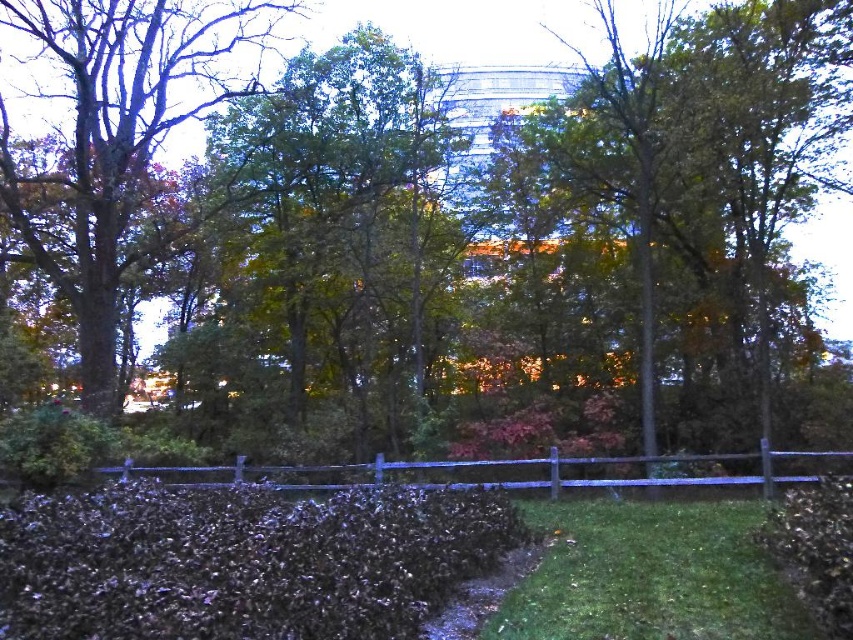
Consider the image. Is dark green leafy hedge at lower left smaller than green grass at center?

Incorrect, dark green leafy hedge at lower left is not smaller in size than green grass at center.

Who is higher up, dark green leafy hedge at lower left or green grass at center?

Positioned higher is dark green leafy hedge at lower left.

The width and height of the screenshot is (853, 640). Describe the element at coordinates (241, 561) in the screenshot. I see `dark green leafy hedge at lower left` at that location.

The width and height of the screenshot is (853, 640). What are the coordinates of `dark green leafy hedge at lower left` in the screenshot? It's located at 241,561.

Is point (390, 282) in front of point (283, 577)?

No.

Identify the location of green leafy tree at center. This screenshot has width=853, height=640. (339, 244).

Image resolution: width=853 pixels, height=640 pixels. I want to click on green leafy tree at center, so click(339, 244).

Can you confirm if green leafy tree at left is shorter than green grass at center?

Incorrect, green leafy tree at left's height does not fall short of green grass at center's.

Can you confirm if green leafy tree at left is positioned above green grass at center?

Indeed, green leafy tree at left is positioned over green grass at center.

Between point (160, 51) and point (596, 632), which one is positioned behind?

The point (160, 51) is behind.

At what (x,y) coordinates should I click in order to perform the action: click on green leafy tree at left. Please return your answer as a coordinate pair (x, y). Image resolution: width=853 pixels, height=640 pixels. Looking at the image, I should click on (117, 145).